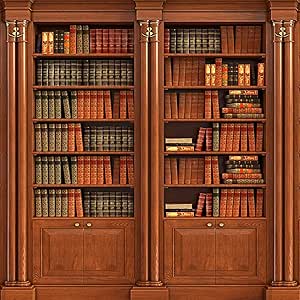
At what (x,y) coordinates should I click in order to perform the action: click on round knob. Please return your answer as a coordinate pair (x, y). Image resolution: width=300 pixels, height=300 pixels. Looking at the image, I should click on (77, 224), (88, 223), (209, 224), (221, 224).